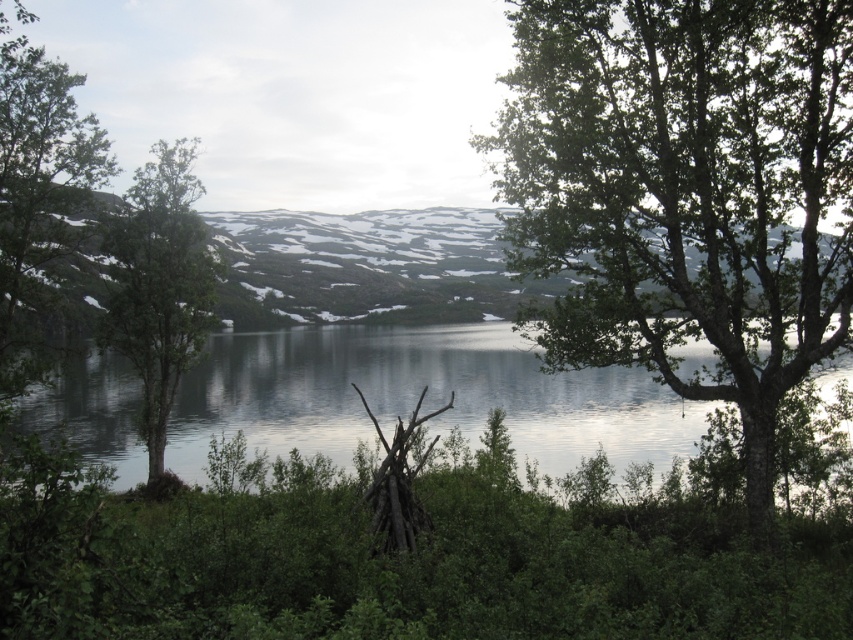
Which is above, clear water at center or green leafy tree at left?

Positioned higher is green leafy tree at left.

Is point (577, 388) farther from viewer compared to point (171, 348)?

Yes, point (577, 388) is farther from viewer.

Locate an element on the screen. This screenshot has height=640, width=853. clear water at center is located at coordinates (416, 396).

The height and width of the screenshot is (640, 853). What do you see at coordinates (685, 192) in the screenshot? I see `green leafy tree at upper right` at bounding box center [685, 192].

This screenshot has width=853, height=640. What do you see at coordinates (685, 192) in the screenshot?
I see `green leafy tree at upper right` at bounding box center [685, 192].

Locate an element on the screen. The image size is (853, 640). green leafy tree at upper right is located at coordinates (685, 192).

Between green leafy tree at upper right and snowy rock mountain at center, which one appears on the left side from the viewer's perspective?

Positioned to the left is snowy rock mountain at center.

The width and height of the screenshot is (853, 640). What do you see at coordinates (685, 192) in the screenshot?
I see `green leafy tree at upper right` at bounding box center [685, 192].

Is point (720, 323) more distant than point (280, 240)?

No, it is in front of (280, 240).

Locate an element on the screen. This screenshot has height=640, width=853. green leafy tree at upper right is located at coordinates (685, 192).